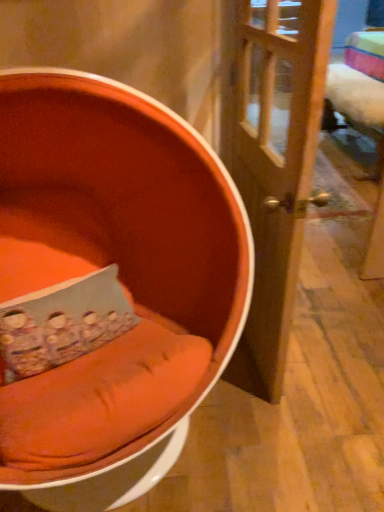
Image resolution: width=384 pixels, height=512 pixels. Identify the location of free space in front of wooden door at center. 277,435.